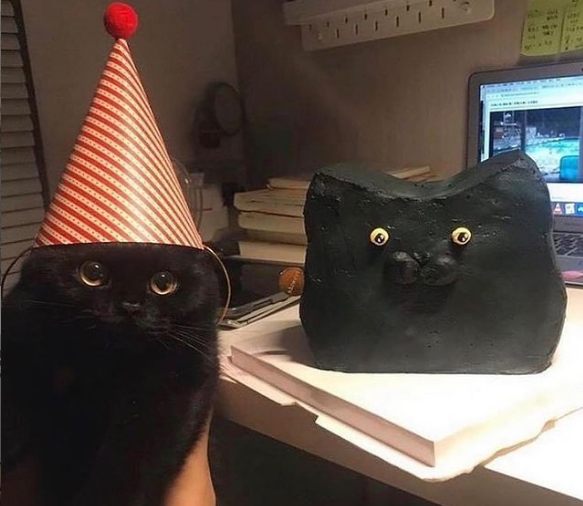
Locate an element on the screen. cat statue's left eye is located at coordinates (459, 245).